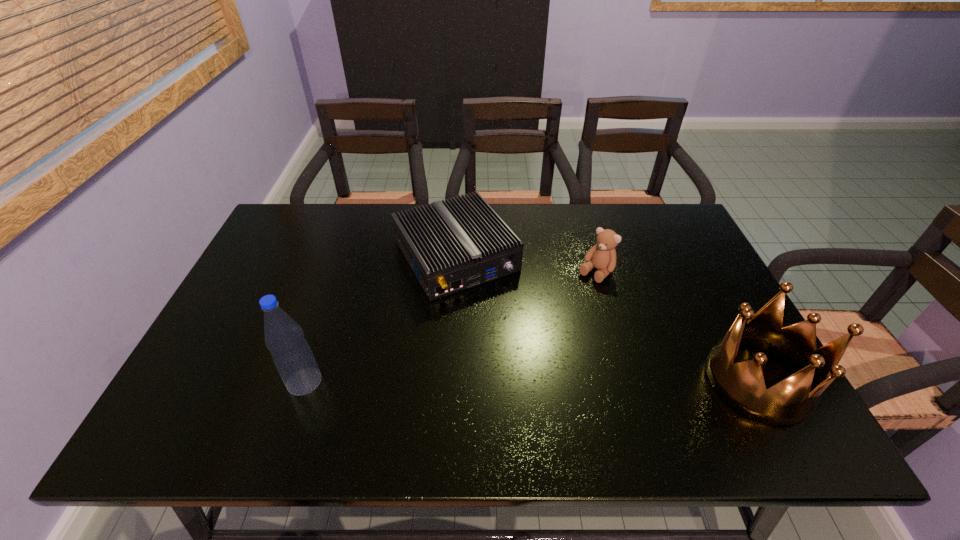
Find the location of `object located in the near right corner section of the desktop`. object located in the near right corner section of the desktop is located at coordinates (742, 385).

You are a GUI agent. You are given a task and a screenshot of the screen. Output one action in this format:
    pyautogui.click(x=<x>, y=<y>)
    Task: Click on the blank space at the far edge of the desktop
    
    Given the screenshot: What is the action you would take?
    pyautogui.click(x=543, y=244)

The width and height of the screenshot is (960, 540). In the image, there is a desktop. What are the coordinates of `vacant space at the near edge` in the screenshot? It's located at click(x=626, y=390).

You are a GUI agent. You are given a task and a screenshot of the screen. Output one action in this format:
    pyautogui.click(x=<x>, y=<y>)
    Task: Click on the free space at the left edge
    The height and width of the screenshot is (540, 960).
    Given the screenshot: What is the action you would take?
    pyautogui.click(x=256, y=261)

You are a GUI agent. You are given a task and a screenshot of the screen. Output one action in this format:
    pyautogui.click(x=<x>, y=<y>)
    Task: Click on the free location at the right edge of the desktop
    This screenshot has height=540, width=960.
    Given the screenshot: What is the action you would take?
    pyautogui.click(x=668, y=258)

Identify the location of vacant space at the far left corner. (275, 238).

At what (x,y) coordinates should I click in order to perform the action: click on free space at the far right corner. Please return your answer as a coordinate pair (x, y). Looking at the image, I should click on (667, 238).

Where is `vacant area that lies between the crown and the shortest object`? This screenshot has height=540, width=960. vacant area that lies between the crown and the shortest object is located at coordinates (607, 319).

You are a GUI agent. You are given a task and a screenshot of the screen. Output one action in this format:
    pyautogui.click(x=<x>, y=<y>)
    Task: Click on the free point between the third object from right to left and the leftmost object
    
    Given the screenshot: What is the action you would take?
    380,319

Where is `vacant area that lies between the leftmost object and the router`? The height and width of the screenshot is (540, 960). vacant area that lies between the leftmost object and the router is located at coordinates (380, 319).